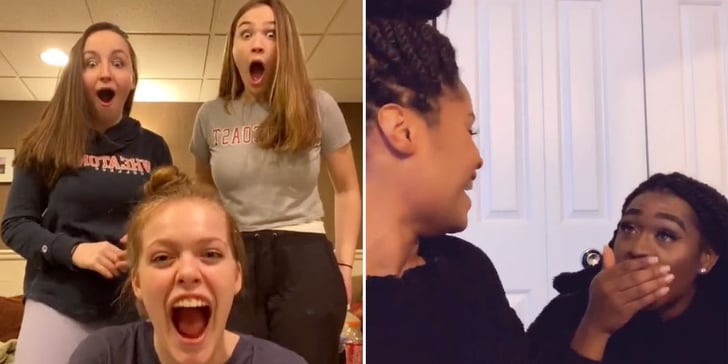
Image resolution: width=728 pixels, height=364 pixels. In order to click on white doors in this screenshot , I will do `click(520, 122)`, `click(587, 109)`.